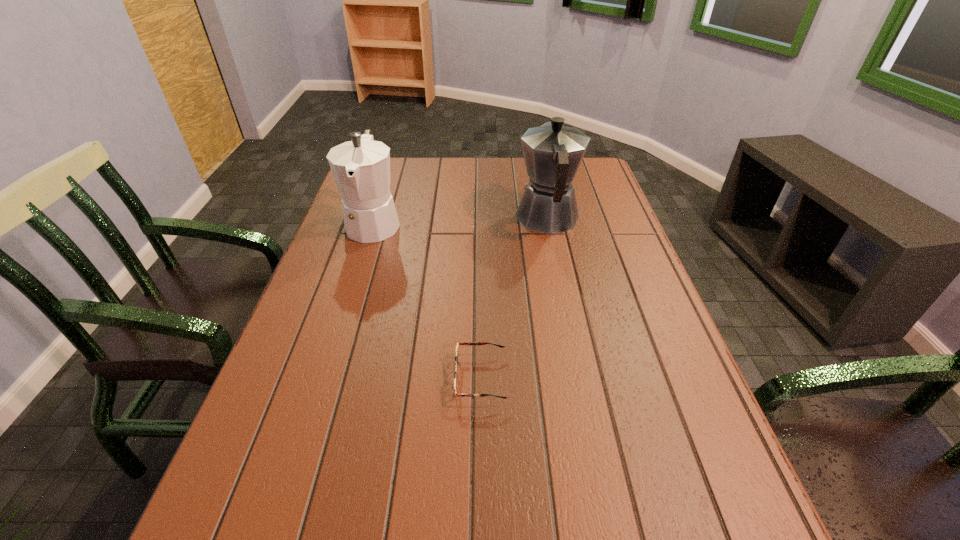
The height and width of the screenshot is (540, 960). What are the coordinates of `the right coffeepot` in the screenshot? It's located at (552, 152).

Identify the location of the leftmost object. The height and width of the screenshot is (540, 960). (361, 168).

Identify the location of the shortest object. (461, 343).

I want to click on the second object from left to right, so click(x=461, y=343).

This screenshot has width=960, height=540. I want to click on blank space located 0.150m at the spout of the right coffeepot, so click(x=538, y=173).

What are the coordinates of `free point located 0.080m at the spout of the right coffeepot` in the screenshot? It's located at (540, 183).

This screenshot has height=540, width=960. I want to click on vacant space located at the spout of the right coffeepot, so click(x=536, y=160).

Locate an element on the screen. This screenshot has width=960, height=540. vacant area situated 0.280m at the spout of the left coffeepot is located at coordinates (341, 328).

The height and width of the screenshot is (540, 960). In order to click on free space located 0.180m on the frame of the shortest object in this screenshot , I will do `click(363, 378)`.

Find the location of `vacant space situated on the frame of the shortest object`. vacant space situated on the frame of the shortest object is located at coordinates (277, 378).